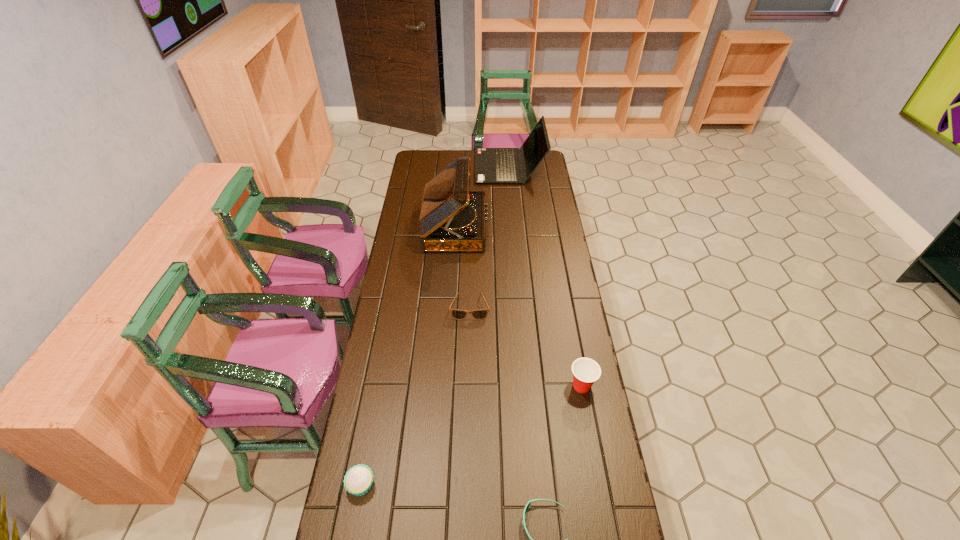
Where is `cup that is at the right edge`? cup that is at the right edge is located at coordinates (586, 371).

What are the coordinates of `object that is at the far right corner` in the screenshot? It's located at (492, 165).

The image size is (960, 540). In order to click on free point at the left edge in this screenshot , I will do `click(409, 349)`.

Where is `vacant space at the right edge of the desktop`? The height and width of the screenshot is (540, 960). vacant space at the right edge of the desktop is located at coordinates (531, 236).

Locate an element on the screen. Image resolution: width=960 pixels, height=540 pixels. free spot between the laptop computer and the farther sunglasses is located at coordinates (490, 237).

I want to click on vacant area that lies between the second tallest object and the cupcake, so click(x=435, y=326).

At what (x,y) coordinates should I click in order to perform the action: click on free spot between the second shortest object and the farthest object. Please return your answer as a coordinate pair (x, y). The height and width of the screenshot is (540, 960). Looking at the image, I should click on [490, 237].

This screenshot has width=960, height=540. Find the location of `free spot between the farthest object and the fifth farthest object`. free spot between the farthest object and the fifth farthest object is located at coordinates (435, 326).

You are a GUI agent. You are given a task and a screenshot of the screen. Output one action in this format:
    pyautogui.click(x=<x>, y=<y>)
    Task: Click on the vacant space in between the tallest object and the second nearest object
    The width and height of the screenshot is (960, 540).
    Given the screenshot: What is the action you would take?
    pyautogui.click(x=408, y=356)

The height and width of the screenshot is (540, 960). Identify the location of free space between the left sunglasses and the fifth farthest object. (416, 396).